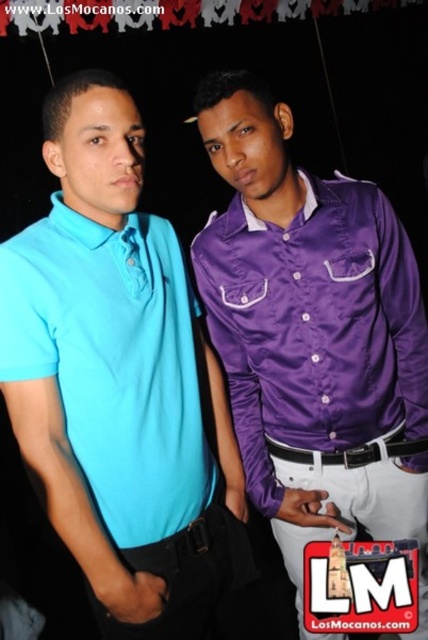
You are a photographer setting up for a portrait shoot. You need to ensure there is enough space between the matte blue polo shirt at left and the white leather belt at center for a clear focus. The minimum required distance for your camera is 18 inches. Can you achieve this?

The matte blue polo shirt at left is 18.26 inches from the white leather belt at center, which exceeds the minimum required distance of 18 inches. Therefore, you can achieve clear focus between them.

Consider the image. You are a photographer setting up a camera at the center of the scene. You notice the purple satin shirt at right and the white leather belt at center. Which object should you adjust your focus on if you want to capture the taller object in the frame?

The purple satin shirt at right is taller than the white leather belt at center, so you should focus on the purple satin shirt at right to capture the taller object in the frame.

You are organizing a photo shoot and need to place a small podium between the matte blue polo shirt at left and the purple satin shirt at right. The podium has a height of 1.2 meters. Which person should stand on the podium so their head is level with the other person?

The purple satin shirt at right should stand on the podium because the matte blue polo shirt at left is taller than the purple satin shirt at right, so placing the shorter person on the podium would align their heights.